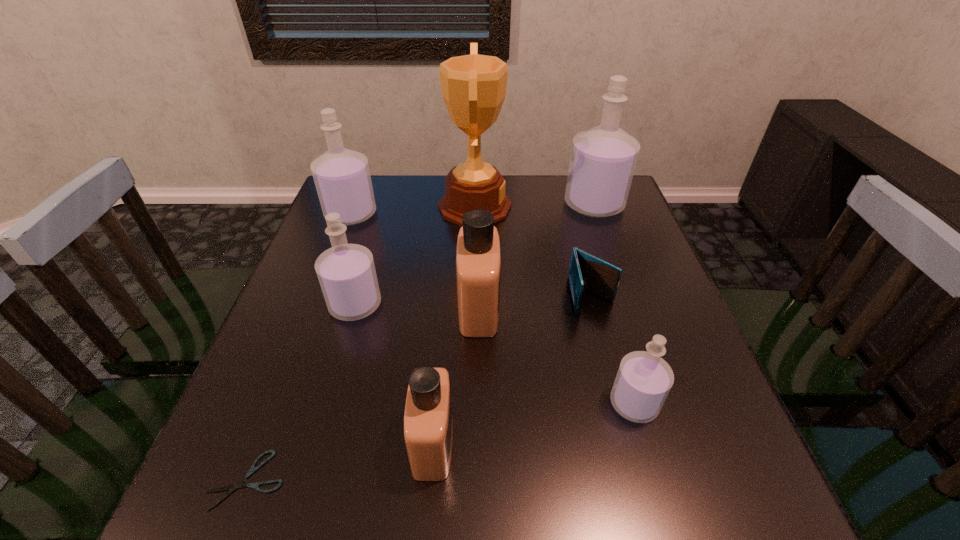
The image size is (960, 540). In order to click on award in this screenshot , I will do `click(473, 86)`.

Where is `the tallest perfume`? the tallest perfume is located at coordinates (603, 159).

Identify the location of the fifth shortest perfume. (342, 177).

Locate an element on the screen. the second biggest purple perfume is located at coordinates (342, 177).

Where is `the second nearest purple perfume`? the second nearest purple perfume is located at coordinates (346, 272).

Locate an element on the screen. The height and width of the screenshot is (540, 960). the bigger beige perfume is located at coordinates (478, 265).

At what (x,y) coordinates should I click in order to perform the action: click on the nearest purple perfume. Please return your answer as a coordinate pair (x, y). This screenshot has height=540, width=960. Looking at the image, I should click on (643, 381).

Locate an element on the screen. This screenshot has height=540, width=960. the nearer beige perfume is located at coordinates (428, 425).

Where is `wallet`? wallet is located at coordinates (586, 272).

Locate an element on the screen. The height and width of the screenshot is (540, 960). blue wallet is located at coordinates (586, 272).